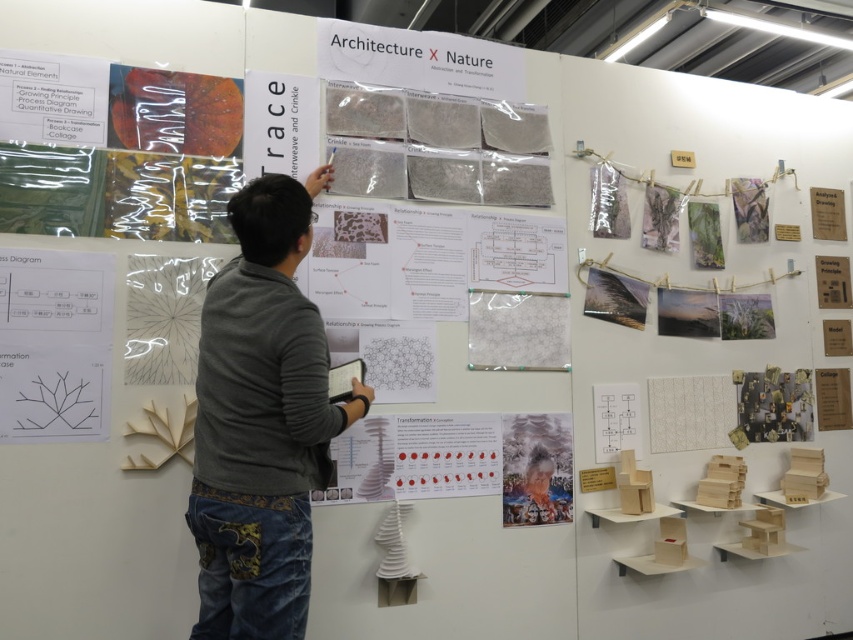
Question: Is black line diagram at lower left above matte paper portrait at center?

Choices:
 (A) yes
 (B) no

Answer: (A)

Question: Which object appears farthest from the camera in this image?

Choices:
 (A) black line diagram at lower left
 (B) matte paper portrait at center

Answer: (B)

Question: Which point is farther to the camera?

Choices:
 (A) gray sweater at center
 (B) white felt at center
 (C) black line diagram at lower left
 (D) matte paper portrait at center

Answer: (D)

Question: Does white felt at center appear under matte paper portrait at center?

Choices:
 (A) no
 (B) yes

Answer: (A)

Question: Can you confirm if black line diagram at lower left is thinner than matte paper portrait at center?

Choices:
 (A) no
 (B) yes

Answer: (A)

Question: Which point is farther to the camera?

Choices:
 (A) black line diagram at lower left
 (B) gray sweater at center
 (C) white felt at center
 (D) matte paper portrait at center

Answer: (D)